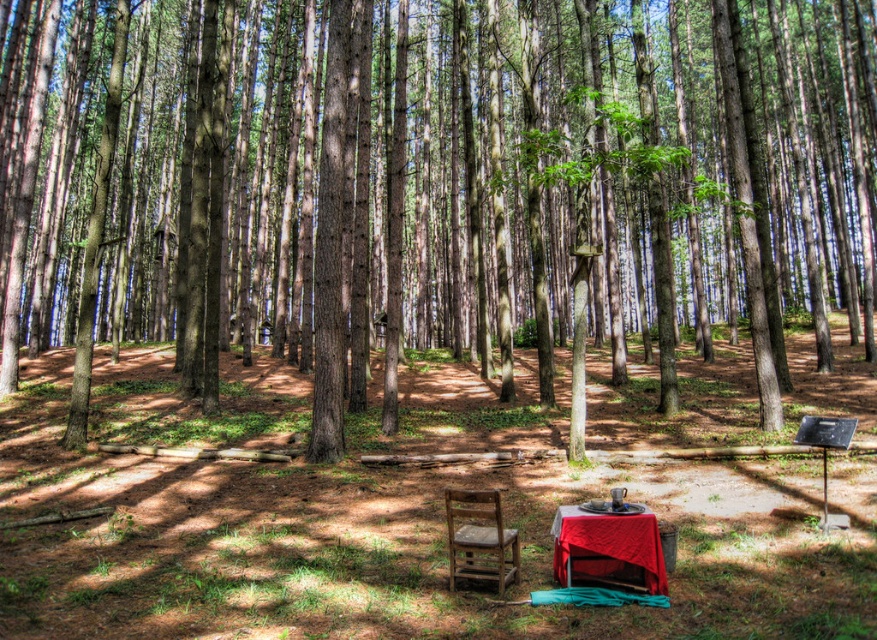
Question: Which point is farther to the camera?

Choices:
 (A) red cloth-covered table at center
 (B) brown wood tree at center
 (C) wooden chair at center

Answer: (B)

Question: Estimate the real-world distances between objects in this image. Which object is farther from the wooden chair at center?

Choices:
 (A) brown wood tree at center
 (B) red cloth-covered table at center

Answer: (A)

Question: Observing the image, what is the correct spatial positioning of brown wood tree at center in reference to wooden chair at center?

Choices:
 (A) right
 (B) left

Answer: (A)

Question: Does red cloth-covered table at center have a greater width compared to wooden chair at center?

Choices:
 (A) no
 (B) yes

Answer: (B)

Question: Which of the following is the closest to the observer?

Choices:
 (A) red cloth-covered table at center
 (B) brown wood tree at center

Answer: (A)

Question: Does brown wood tree at center have a greater width compared to wooden chair at center?

Choices:
 (A) yes
 (B) no

Answer: (A)